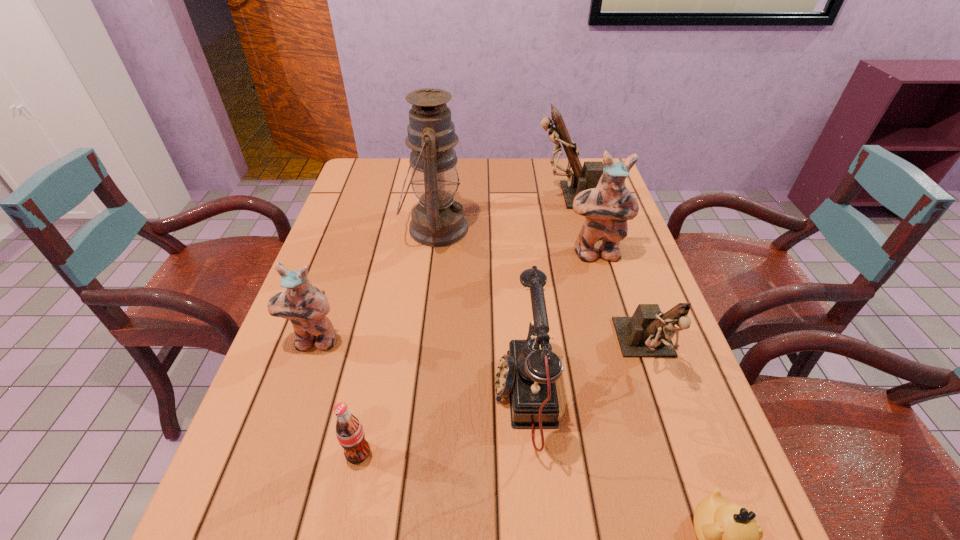
Identify the location of figurine that stands as the second closest to the soda. (648, 333).

Find the location of `vacant area that satisfies the following two spatial constraints: 1. on the front-facing side of the farther pink figurine; 2. on the dial of the black telephone`. vacant area that satisfies the following two spatial constraints: 1. on the front-facing side of the farther pink figurine; 2. on the dial of the black telephone is located at coordinates (637, 397).